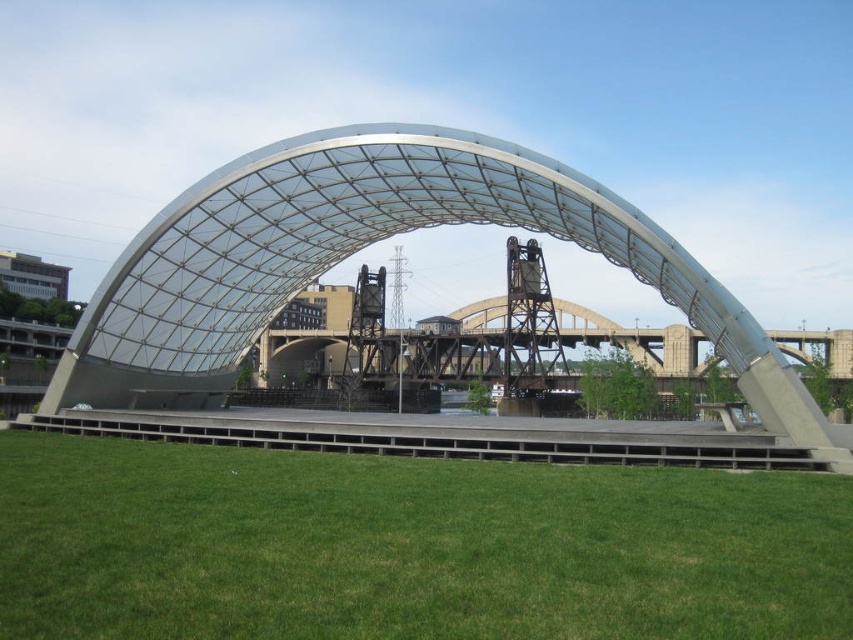
You are planning to set up a tent for an event. You see the green grass at lower center and the transparent glass dome at center. Which location would be more suitable for setting up the tent based on their positions?

The green grass at lower center is below the transparent glass dome at center, so setting up the tent on the green grass at lower center would be more suitable as it is on the ground level and offers a stable base, while the transparent glass dome at center is an elevated structure and likely not suitable for tent setup.

You are planning to set up a tent for an event and need to know which area is lower in height between the green grass at lower center and the transparent glass dome at center. Which one is shorter?

The green grass at lower center is shorter than the transparent glass dome at center.

You are a visitor standing at the entrance of the pavilion and want to walk towards the transparent glass dome at center. Which direction should you move relative to the green grass at lower center?

To reach the transparent glass dome at center, you should move away from the green grass at lower center since the green grass at lower center is in front of it.